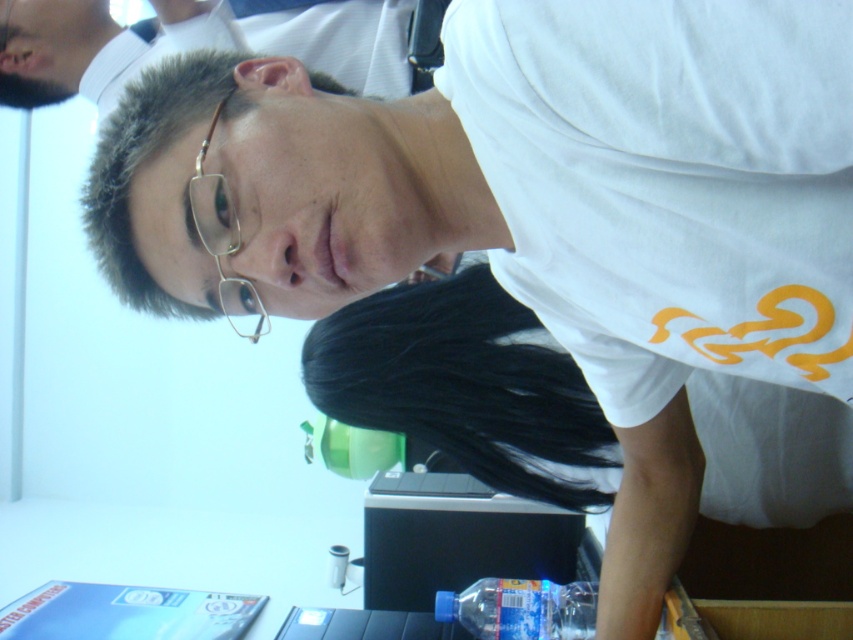
Consider the image. You are at a party and want to grab a drink. You see the gold metallic glasses at upper center and the black plastic table at lower center. Which one is bigger?

The gold metallic glasses at upper center is larger in size than the black plastic table at lower center.

You are standing in the room and want to place a small decoration exactly at the center of the room. The matte white shirt at upper center is located at coordinates point 0.067, 0.250. Is the point 0.067, 0.250 closer to the center of the room than the edge?

The coordinates point (212, 42) for the matte white shirt at upper center is closer to the center of the room than the edge because the center would be at point (426, 320), and the distance from (212, 42) to the center is sqrt of squared differences, which is less than half the diagonal distance to the edge.

You are at a party and want to grab a drink from the table. The gold metallic glasses at upper center and the black plastic table at lower center are in your view. Which object is positioned higher relative to the other?

The gold metallic glasses at upper center are positioned higher than the black plastic table at lower center.